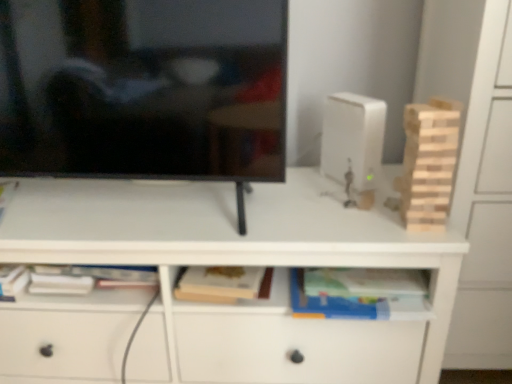
The image size is (512, 384). I want to click on free region under black glossy television at upper left (from a real-world perspective), so click(x=155, y=209).